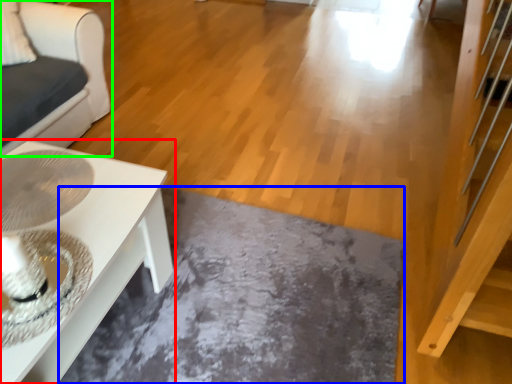
Question: Which object is the closest to the table (highlighted by a red box)? Choose among these: slate (highlighted by a blue box) or furniture (highlighted by a green box).

Choices:
 (A) slate
 (B) furniture

Answer: (A)